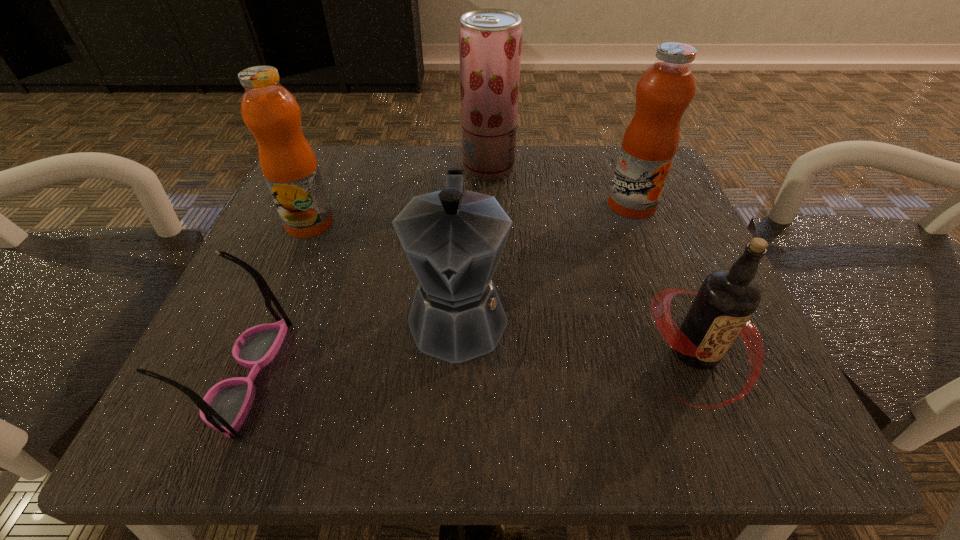
Locate an element on the screen. This screenshot has width=960, height=540. the second fruit juice from left to right is located at coordinates (490, 40).

Locate an element on the screen. The height and width of the screenshot is (540, 960). the farthest fruit juice is located at coordinates (490, 40).

Identify the location of the rightmost fruit juice. pos(664,91).

Locate an element on the screen. Image resolution: width=960 pixels, height=540 pixels. the leftmost fruit juice is located at coordinates (288, 163).

Locate an element on the screen. coffeepot is located at coordinates (453, 238).

Locate an element on the screen. The image size is (960, 540). root beer is located at coordinates tap(726, 300).

At what (x,y) coordinates should I click in order to perform the action: click on the shortest object. Please return your answer as a coordinate pair (x, y). Looking at the image, I should click on pos(224,408).

You are a GUI agent. You are given a task and a screenshot of the screen. Output one action in this format:
    pyautogui.click(x=<x>, y=<y>)
    Task: Click on the vacant space located on the left of the second fruit juice from left to right
    The height and width of the screenshot is (540, 960).
    Given the screenshot: What is the action you would take?
    pyautogui.click(x=327, y=168)

The width and height of the screenshot is (960, 540). Find the location of `vacant area situated on the front label of the rightmost fruit juice`. vacant area situated on the front label of the rightmost fruit juice is located at coordinates (675, 316).

Where is `vacant region located 0.120m on the right of the leftmost fruit juice`? This screenshot has width=960, height=540. vacant region located 0.120m on the right of the leftmost fruit juice is located at coordinates (401, 224).